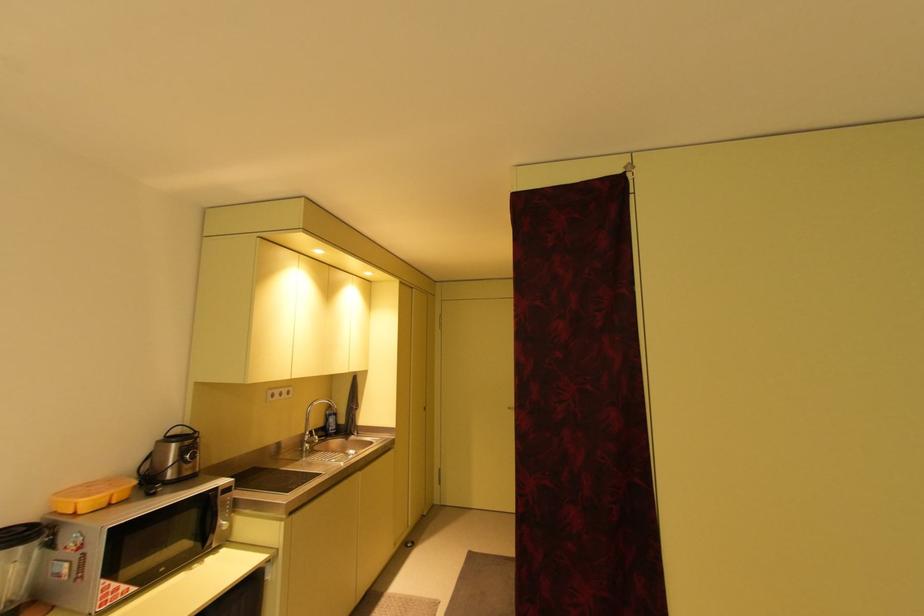
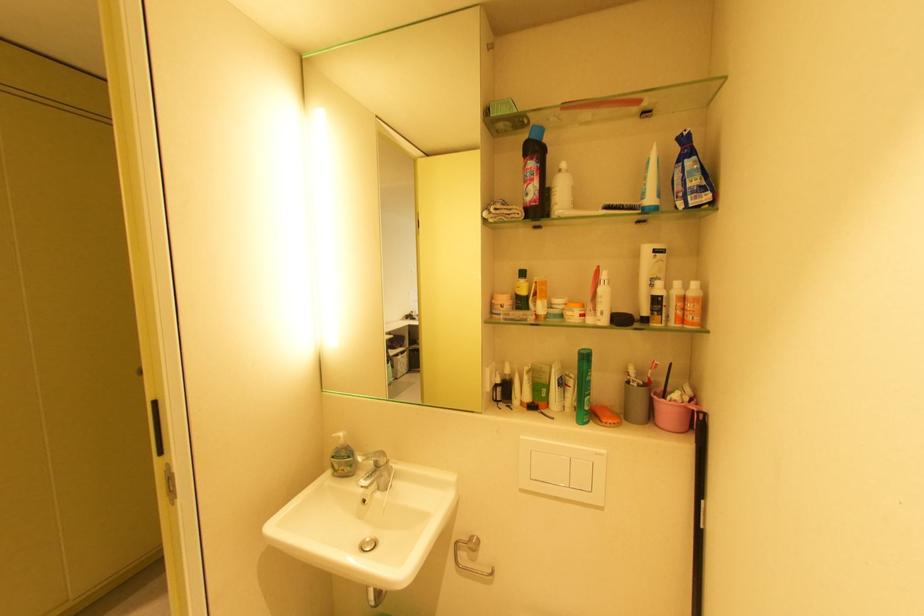
Which direction would the cameraman need to move to produce the second image?

The cameraman walked toward right, forward.